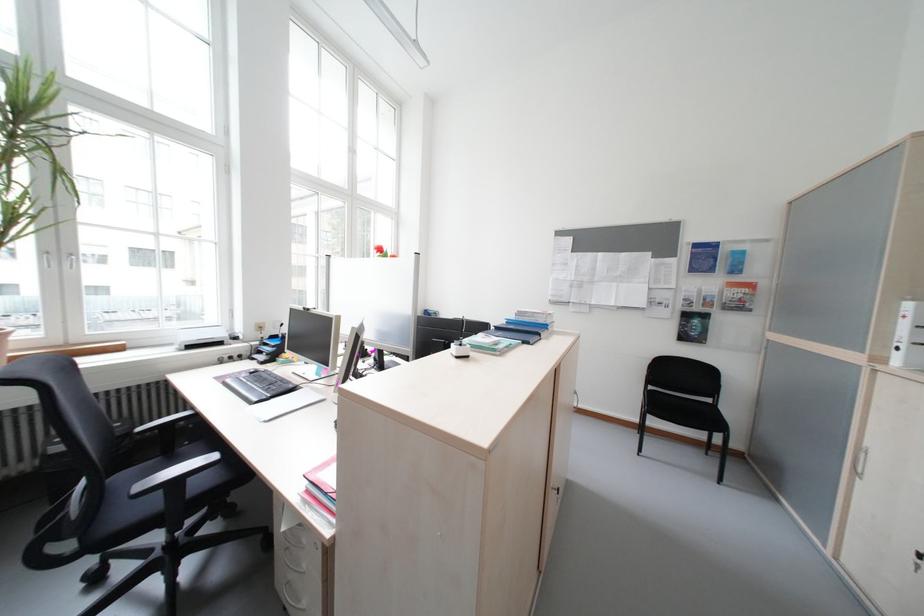
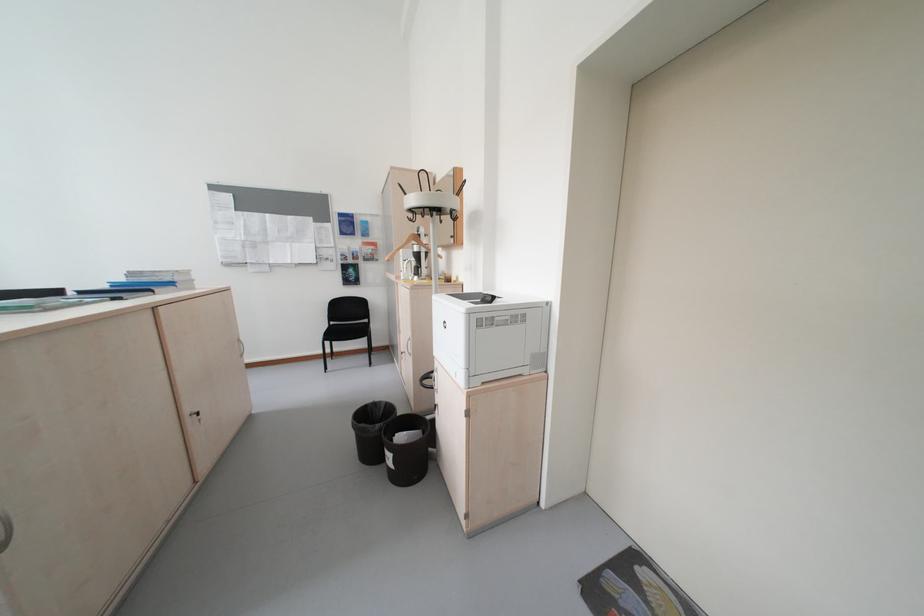
Find the pixel in the second image that matches [772,305] in the first image.

(393, 257)